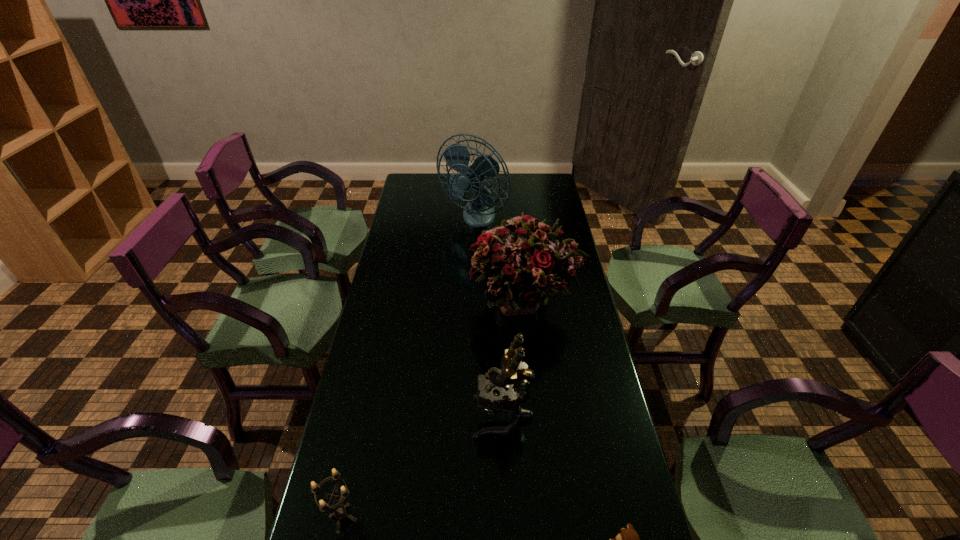
Where is `free space located at the eyepieces of the microscope`? free space located at the eyepieces of the microscope is located at coordinates (454, 417).

Identify the location of vacant space located 0.380m on the right of the candle holder. (525, 518).

You are a GUI agent. You are given a task and a screenshot of the screen. Output one action in this format:
    pyautogui.click(x=<x>, y=<y>)
    Task: Click on the object at the left edge
    
    Given the screenshot: What is the action you would take?
    pyautogui.click(x=341, y=513)

Find the location of a particular element. object positioned at the right edge is located at coordinates (521, 260).

In the image, there is a desktop. Identify the location of free space at the far edge. This screenshot has width=960, height=540. (515, 183).

Image resolution: width=960 pixels, height=540 pixels. What are the coordinates of `free region at the left edge` in the screenshot? It's located at (372, 321).

The height and width of the screenshot is (540, 960). In the image, there is a desktop. In order to click on vacant space at the right edge in this screenshot , I will do `click(531, 216)`.

Find the location of a particular element. vacant space at the far left corner of the desktop is located at coordinates (401, 193).

Where is `vacant space at the far right corner of the desktop`? Image resolution: width=960 pixels, height=540 pixels. vacant space at the far right corner of the desktop is located at coordinates (529, 189).

Image resolution: width=960 pixels, height=540 pixels. I want to click on vacant space in between the second shortest object and the microscope, so click(x=422, y=468).